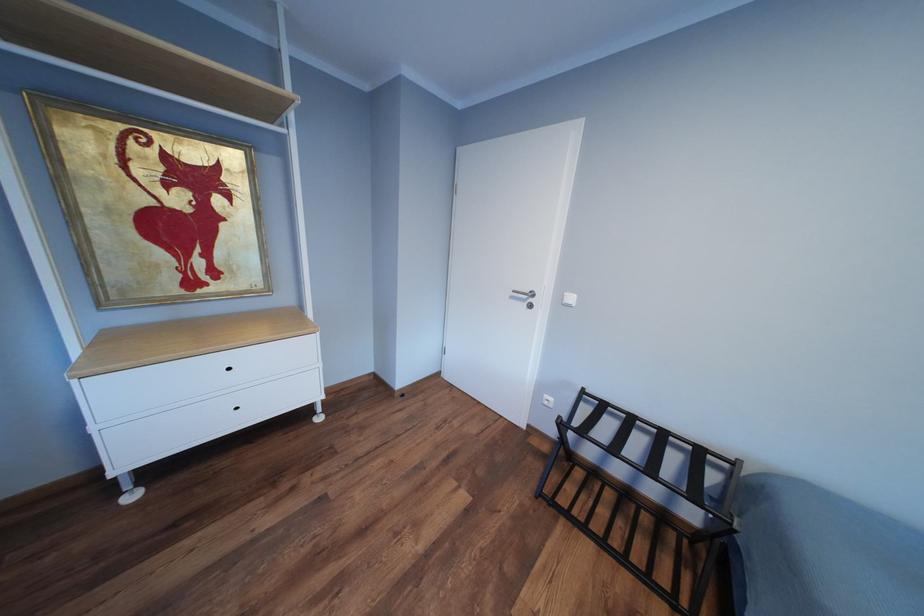
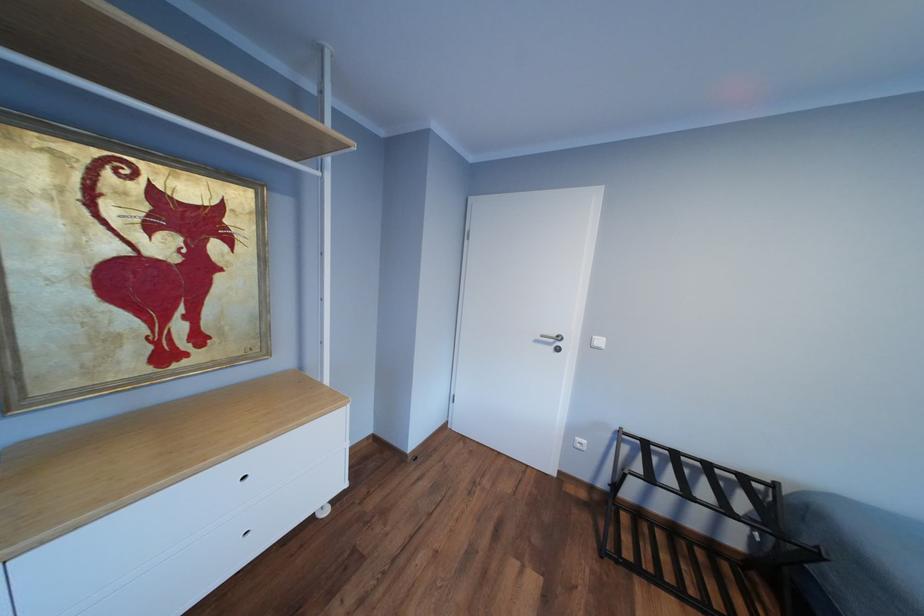
Question: The first image is from the beginning of the video and the second image is from the end. How did the camera likely rotate when shooting the video?

Choices:
 (A) Left
 (B) Right
 (C) Up
 (D) Down

Answer: (B)